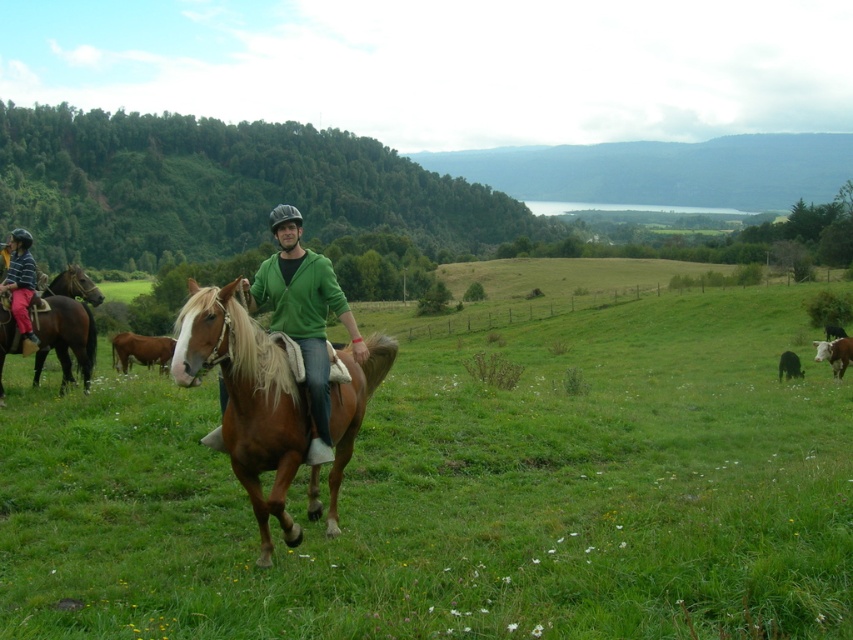
Question: Is green grassy field at center to the right of brown glossy horse at center from the viewer's perspective?

Choices:
 (A) no
 (B) yes

Answer: (B)

Question: Which object appears farthest from the camera in this image?

Choices:
 (A) brown glossy horse at center
 (B) green grassy field at center
 (C) brown glossy horse at lower right
 (D) brown glossy horse at left

Answer: (C)

Question: Does green matte jacket at center appear on the left side of brown glossy horse at lower right?

Choices:
 (A) no
 (B) yes

Answer: (B)

Question: Is brown glossy horse at center closer to the viewer compared to brown glossy horse at left?

Choices:
 (A) no
 (B) yes

Answer: (B)

Question: Which object is the closest to the green grassy field at center?

Choices:
 (A) green matte jacket at center
 (B) brown glossy horse at lower right
 (C) brown glossy horse at left

Answer: (B)

Question: Which object is closer to the camera taking this photo?

Choices:
 (A) green matte jacket at center
 (B) brown glossy horse at lower right

Answer: (A)